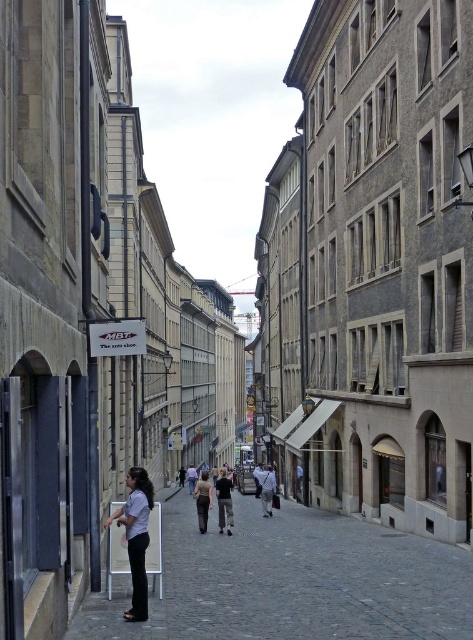
Which is below, white paper at center or light brown fabric shirt at center?

white paper at center is below.

Who is more forward, (313, 580) or (147, 516)?

Point (147, 516) is more forward.

Is point (301, 564) less distant than point (139, 548)?

No, it is not.

I want to click on white paper at center, so click(x=291, y=580).